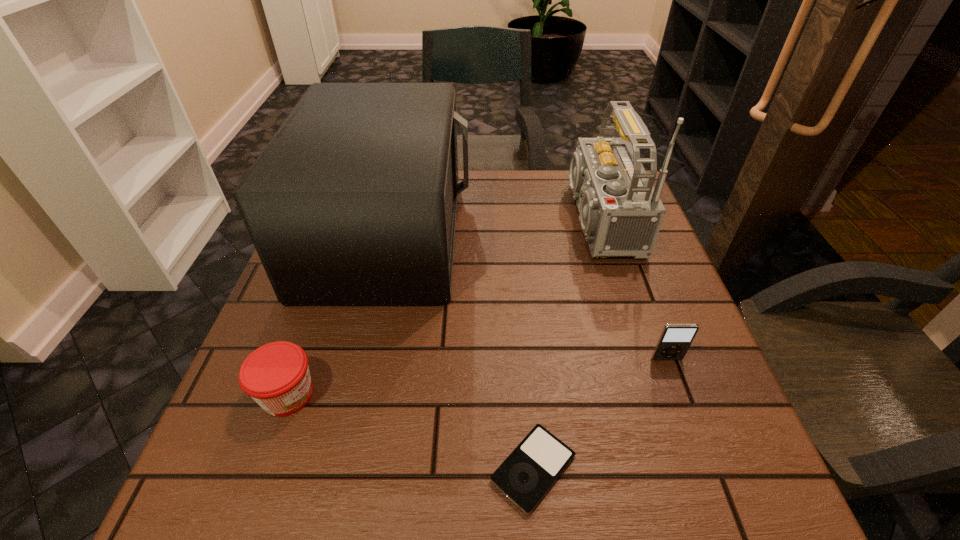
What are the coordinates of `iPod situated at the right edge` in the screenshot? It's located at (675, 339).

I want to click on object positioned at the far left corner, so click(x=353, y=202).

Find the location of a particular element. The height and width of the screenshot is (540, 960). object that is at the far right corner is located at coordinates (621, 213).

At what (x,y) coordinates should I click in order to perform the action: click on vacant space at the far edge of the desktop. Please return your answer as a coordinate pair (x, y). The width and height of the screenshot is (960, 540). Looking at the image, I should click on (539, 217).

The width and height of the screenshot is (960, 540). I want to click on blank space at the left edge of the desktop, so [263, 330].

I want to click on free space at the right edge of the desktop, so coord(657,318).

The image size is (960, 540). I want to click on vacant position at the near left corner of the desktop, so click(233, 466).

What are the coordinates of `vacant point located between the jam and the taller iPod` in the screenshot? It's located at (477, 377).

Where is `vacant area between the radio receiver and the farther iPod`? vacant area between the radio receiver and the farther iPod is located at coordinates (630, 289).

The width and height of the screenshot is (960, 540). I want to click on free point between the microwave oven and the radio receiver, so click(490, 226).